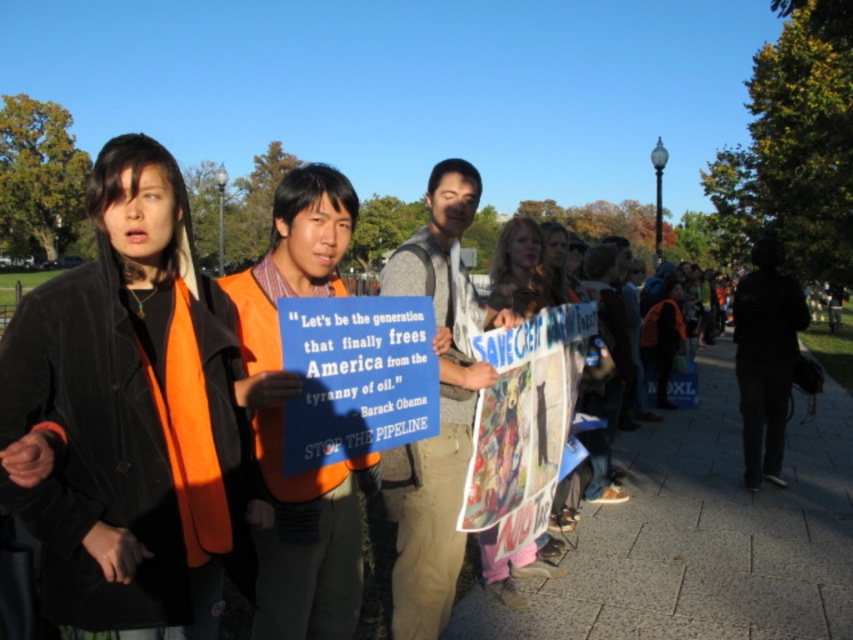
You are a photographer standing in front of the orange reflective vest at center and the orange safety vest at center. Which one is nearer to you?

The orange reflective vest at center is closer to you than the orange safety vest at center.